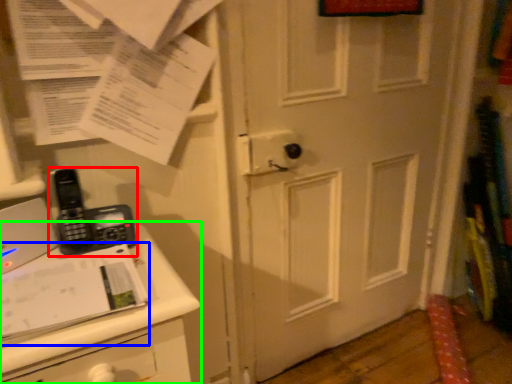
Question: Which object is the closest to the corded phone (highlighted by a red box)? Choose among these: journal (highlighted by a blue box) or changing table (highlighted by a green box).

Choices:
 (A) journal
 (B) changing table

Answer: (A)